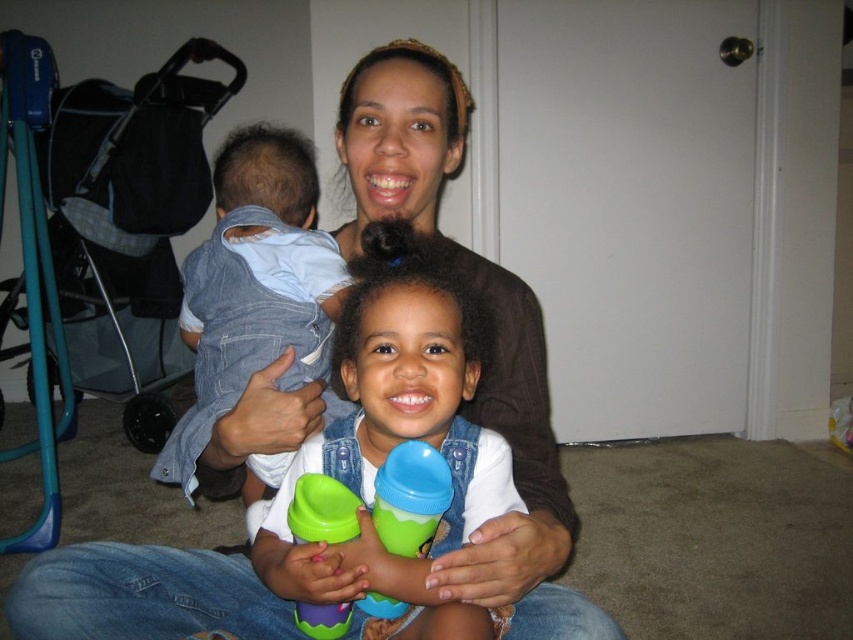
You are standing at point (241,244) and want to move to point (502,317). Is the path clear? Please explain based on their positions.

Point (502,317) is behind point (241,244), so the path is blocked by point (241,244).

You are a photographer setting up for a family portrait. You need to ensure that the matte brown shirt at center and the denim at left are both visible in the frame. Based on their positions, which object should you focus on first to capture both in the shot?

The matte brown shirt at center is located below denim at left, so focusing on the denim at left first would allow both objects to be captured in the frame since the denim is higher up and the shirt is positioned lower.

You are a photographer setting up for a family photo. You notice the matte brown shirt at center and the green rubber sippy cup at center in the scene. Which object is positioned to the right side from the photographer perspective?

The matte brown shirt at center is to the right of the green rubber sippy cup at center, so the matte brown shirt at center is positioned to the right side from the photographer perspective.